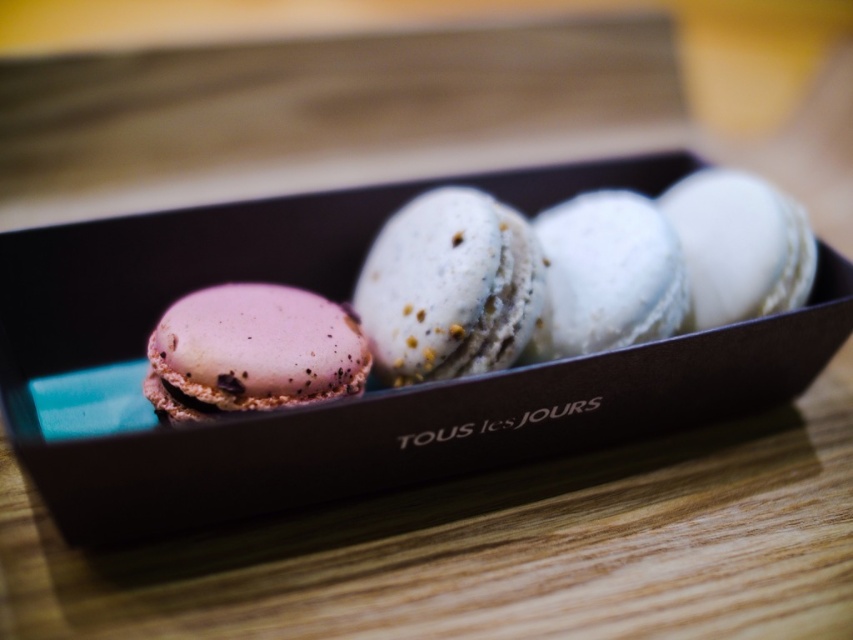
You are holding a spoon that is 2 feet long. You want to reach the white textured macaron at center from your current position. Can the spoon reach it?

The white textured macaron at center is 4.13 feet from the viewer. Since the spoon is only 2 feet long, it cannot reach the macaron as the distance is greater than the spoon length.

Looking at this image, you are placing a pink matte macaron at left into a matte black box at center. Will the macaron fit inside the box?

The matte black box at center is located above the pink matte macaron at left, so the macaron can be placed inside the box.

You are at a bakery and see the matte black box at center and the pink matte macaron at left. Which one is positioned more to the left side?

The pink matte macaron at left is positioned more to the left side than the matte black box at center.